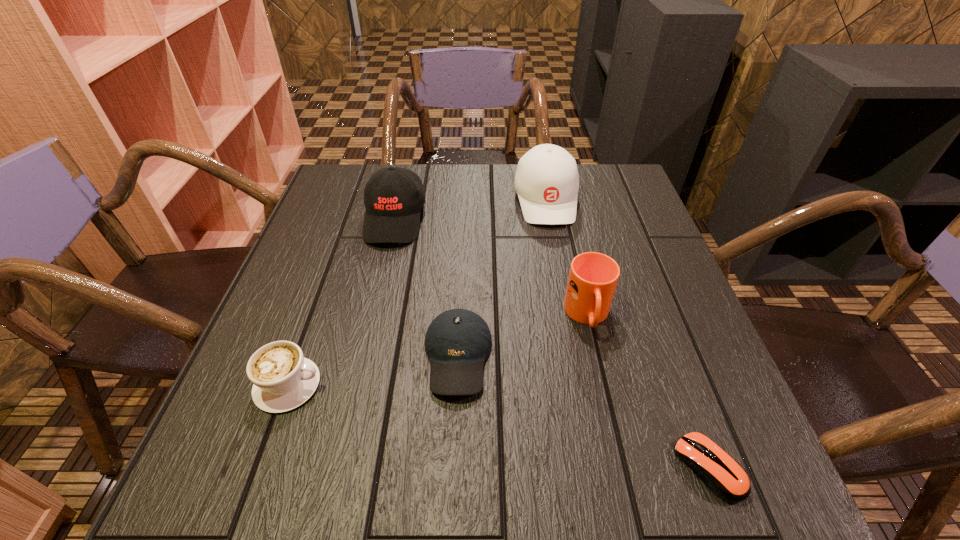
Where is `free space that satisfies the following two spatial constraints: 1. on the front-facing side of the rightmost baseball cap; 2. to the right of the cappuccino's handle`? free space that satisfies the following two spatial constraints: 1. on the front-facing side of the rightmost baseball cap; 2. to the right of the cappuccino's handle is located at coordinates (581, 385).

Locate an element on the screen. This screenshot has width=960, height=540. vacant region that satisfies the following two spatial constraints: 1. on the front-facing side of the second baseball cap from left to right; 2. to the right of the cappuccino's handle is located at coordinates (457, 385).

Identify the location of free space that satisfies the following two spatial constraints: 1. to the right of the rightmost object's handle; 2. on the left side of the cappuccino. (259, 468).

The height and width of the screenshot is (540, 960). Find the location of `vacant space that satisfies the following two spatial constraints: 1. on the front-facing side of the leftmost baseball cap; 2. to the right of the cappuccino's handle`. vacant space that satisfies the following two spatial constraints: 1. on the front-facing side of the leftmost baseball cap; 2. to the right of the cappuccino's handle is located at coordinates (356, 385).

You are a GUI agent. You are given a task and a screenshot of the screen. Output one action in this format:
    pyautogui.click(x=<x>, y=<y>)
    Task: Click on the free space that satisfies the following two spatial constraints: 1. on the handle side of the mug; 2. to the right of the cappuccino's handle
    The width and height of the screenshot is (960, 540).
    Given the screenshot: What is the action you would take?
    pyautogui.click(x=604, y=385)

Locate an element on the screen. This screenshot has height=540, width=960. vacant area in the image that satisfies the following two spatial constraints: 1. on the front-facing side of the leftmost baseball cap; 2. to the right of the cappuccino's handle is located at coordinates (356, 385).

Locate an element on the screen. This screenshot has width=960, height=540. free spot that satisfies the following two spatial constraints: 1. on the handle side of the mug; 2. to the right of the cappuccino's handle is located at coordinates (604, 385).

Where is `free space that satisfies the following two spatial constraints: 1. on the front-facing side of the nearest object; 2. on the left side of the third object from left to right`? free space that satisfies the following two spatial constraints: 1. on the front-facing side of the nearest object; 2. on the left side of the third object from left to right is located at coordinates (453, 468).

This screenshot has height=540, width=960. In order to click on free space that satisfies the following two spatial constraints: 1. on the back side of the nearest object; 2. to the right of the cappuccino's handle in this screenshot , I will do `click(678, 385)`.

What are the coordinates of `free space in the image that satisfies the following two spatial constraints: 1. on the front-facing side of the rightmost baseball cap; 2. to the right of the cappuccino's handle` in the screenshot? It's located at (581, 385).